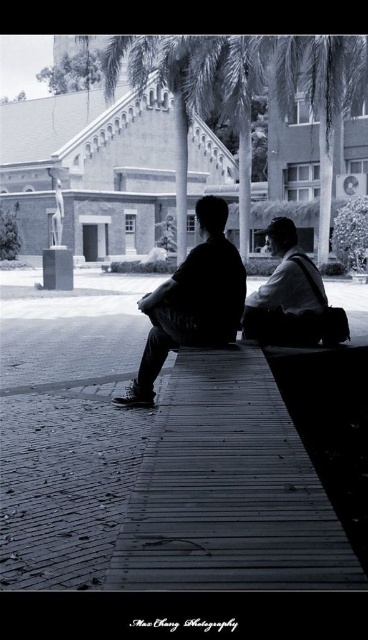
You are standing at the entrance of the historic building and see two points marked in the scene. Which point is closer to you, point (231,289) or point (281,228)?

Point (231,289) is in front of point (281,228), so it is closer to you.

You are standing in front of the historic building and see two people sitting on the wooden bench. One is wearing a black matte jacket at center and the other is wearing a matte black jacket at center. Which jacket is positioned lower on the bench?

The black matte jacket at center is located below the matte black jacket at center, so it is positioned lower on the bench.

You are standing in the scene and see the point at coordinates [192,301]. What object is located at that point?

The point at coordinates [192,301] is where the black matte jacket at center is located.